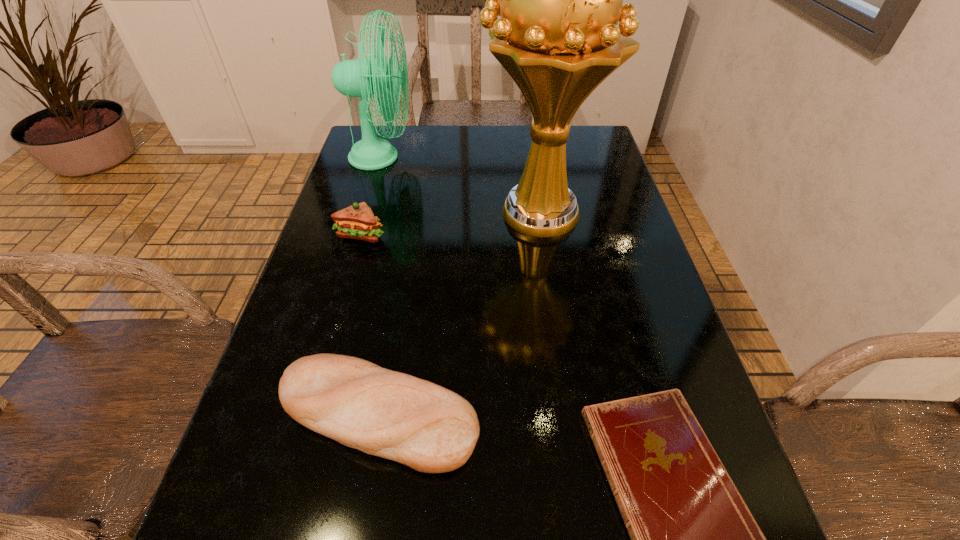
Locate an element on the screen. Image resolution: width=960 pixels, height=540 pixels. object that is at the far edge is located at coordinates (360, 78).

Locate an element on the screen. fan that is at the left edge is located at coordinates (360, 78).

Where is `sandwich that is at the left edge`? This screenshot has width=960, height=540. sandwich that is at the left edge is located at coordinates (357, 221).

You are a GUI agent. You are given a task and a screenshot of the screen. Output one action in this format:
    pyautogui.click(x=<x>, y=<y>)
    Task: Click on the bread located in the left edge section of the desktop
    This screenshot has width=960, height=540.
    Given the screenshot: What is the action you would take?
    pyautogui.click(x=393, y=415)

At what (x,y) coordinates should I click in order to perform the action: click on object located in the right edge section of the desktop. Please return your answer as a coordinate pair (x, y). Looking at the image, I should click on (560, 0).

Where is `object situated at the far left corner`? The height and width of the screenshot is (540, 960). object situated at the far left corner is located at coordinates (360, 78).

Where is `free point at the far edge`? This screenshot has width=960, height=540. free point at the far edge is located at coordinates pos(492,153).

Identify the location of vacant space at the left edge of the desktop. This screenshot has width=960, height=540. (366, 301).

Identify the location of vacant space at the right edge. The width and height of the screenshot is (960, 540). (629, 269).

Where is `unoccupied position between the sandwich and the trophy_cup`? unoccupied position between the sandwich and the trophy_cup is located at coordinates (449, 224).